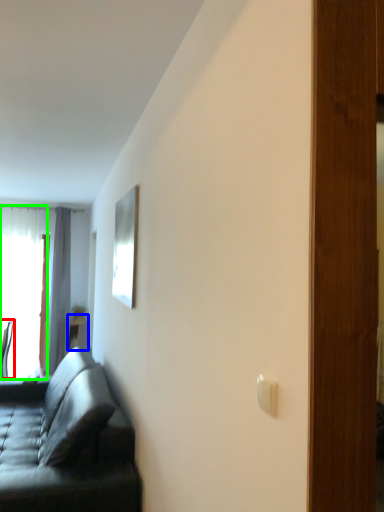
Question: Which object is positioned farthest from chair (highlighted by a red box)? Select from table (highlighted by a blue box) and window (highlighted by a green box).

Choices:
 (A) table
 (B) window

Answer: (A)